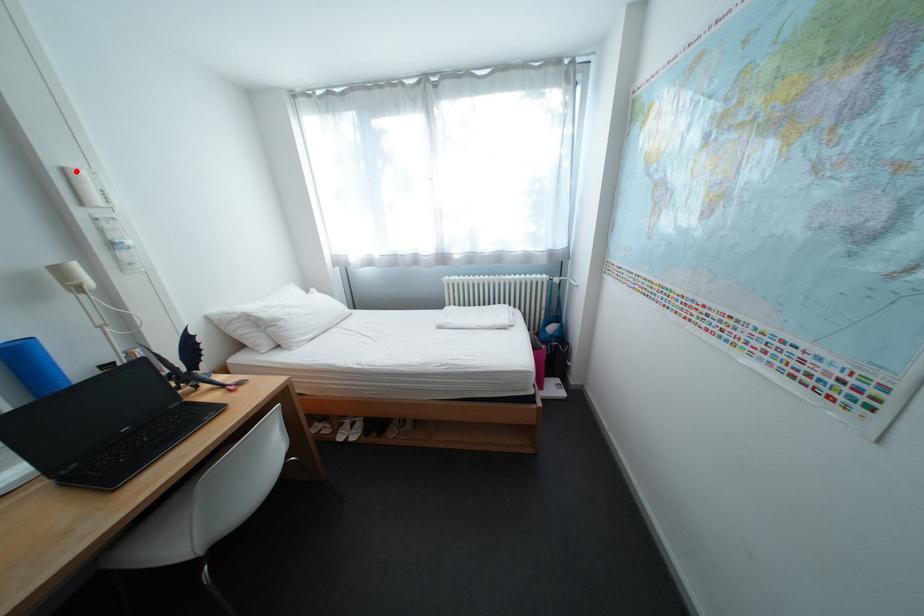
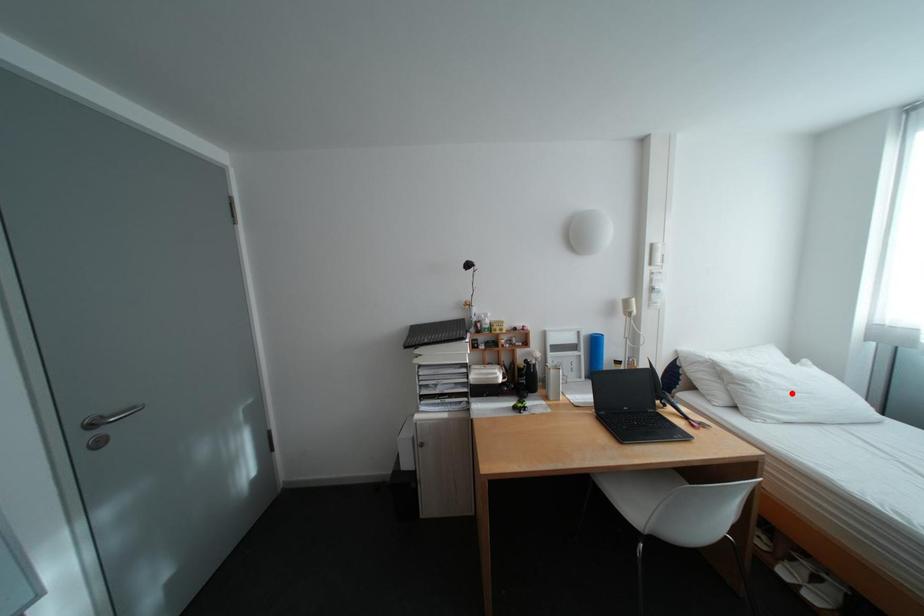
I am providing you with two images of the same scene from different viewpoints. A red point is marked on the first image and another point is marked on the second image. Is the marked point in image1 the same physical position as the marked point in image2?

No